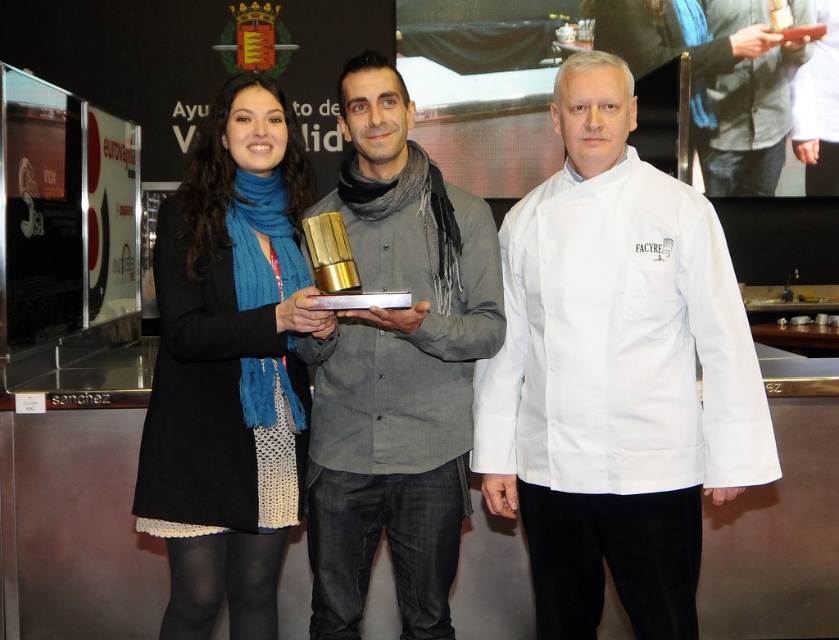
Question: Does matte gold trophy at center lie in front of matte gray scarf at center?

Choices:
 (A) yes
 (B) no

Answer: (B)

Question: Which object is the closest to the matte gold trophy at center?

Choices:
 (A) white fabric chef coat at center
 (B) matte gray scarf at center

Answer: (A)

Question: Can you confirm if matte gold trophy at center is positioned to the right of matte gray scarf at center?

Choices:
 (A) yes
 (B) no

Answer: (A)

Question: Considering the real-world distances, which object is farthest from the black wool coat at left?

Choices:
 (A) matte gold trophy at center
 (B) matte gray scarf at center

Answer: (A)

Question: Does white fabric chef coat at center appear under matte gray scarf at center?

Choices:
 (A) yes
 (B) no

Answer: (A)

Question: Which point appears farthest from the camera in this image?

Choices:
 (A) (548, 195)
 (B) (511, 440)
 (C) (289, 417)
 (D) (379, 232)

Answer: (B)